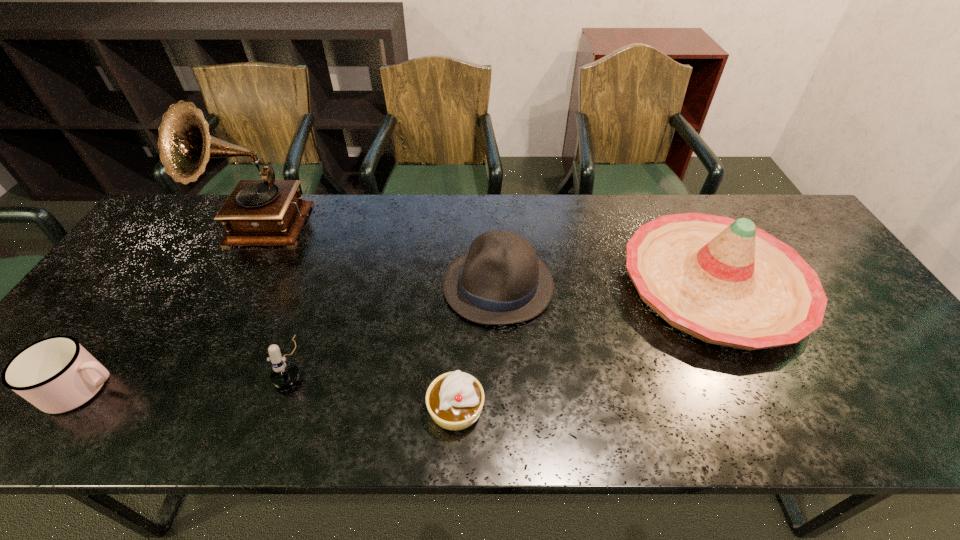
Where is `free space between the bowler hat and the microphone`? Image resolution: width=960 pixels, height=540 pixels. free space between the bowler hat and the microphone is located at coordinates (396, 323).

In order to click on vacant space in between the bowler hat and the third object from left to right in this screenshot , I will do `click(396, 323)`.

I want to click on vacant point located between the whipped cream and the tallest object, so click(x=358, y=318).

You are a GUI agent. You are given a task and a screenshot of the screen. Output one action in this format:
    pyautogui.click(x=<x>, y=<y>)
    Task: Click on the blank region between the mug and the microphone
    The height and width of the screenshot is (540, 960).
    Given the screenshot: What is the action you would take?
    pyautogui.click(x=189, y=375)

Identify the location of free point between the third object from left to right and the shortest object. Image resolution: width=960 pixels, height=540 pixels. (374, 385).

Locate an element on the screen. The image size is (960, 540). free spot between the fourth shortest object and the mug is located at coordinates (291, 337).

What are the coordinates of `object that stands as the fourth closest to the mug` in the screenshot? It's located at (500, 281).

The height and width of the screenshot is (540, 960). Identify the location of object that is the fifth closest to the bowler hat. (56, 374).

Where is `free spot that satisfies the following two spatial constraints: 1. on the horn of the record player; 2. on the side of the mug with the handle`? free spot that satisfies the following two spatial constraints: 1. on the horn of the record player; 2. on the side of the mug with the handle is located at coordinates (174, 388).

Identify the location of free space that satisfies the following two spatial constraints: 1. on the horn of the record player; 2. on the right side of the rightmost object. The image size is (960, 540). (229, 286).